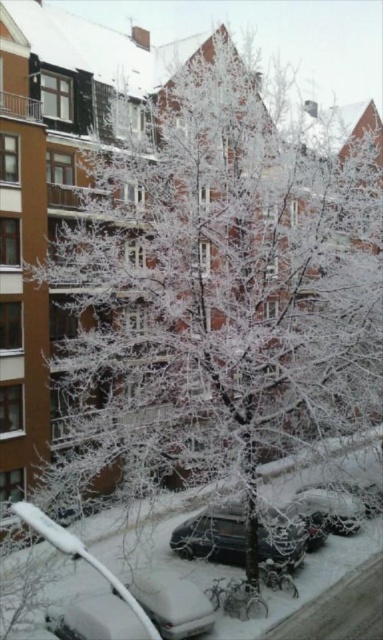
Question: Estimate the real-world distances between objects in this image. Which object is farther from the white frosted car at center?

Choices:
 (A) white matte car at lower left
 (B) shiny black car at center

Answer: (A)

Question: Can you confirm if shiny black car at center is wider than white matte car at lower left?

Choices:
 (A) no
 (B) yes

Answer: (A)

Question: Is white matte car at lower left wider than white frosted car at center?

Choices:
 (A) no
 (B) yes

Answer: (A)

Question: Can you confirm if white matte car at lower left is positioned to the right of white frosted car at center?

Choices:
 (A) yes
 (B) no

Answer: (B)

Question: Which point is farther from the camera taking this photo?

Choices:
 (A) (312, 506)
 (B) (155, 582)

Answer: (A)

Question: Which of the following is the farthest from the observer?

Choices:
 (A) shiny black car at center
 (B) white frosted car at center
 (C) white matte car at lower left

Answer: (B)